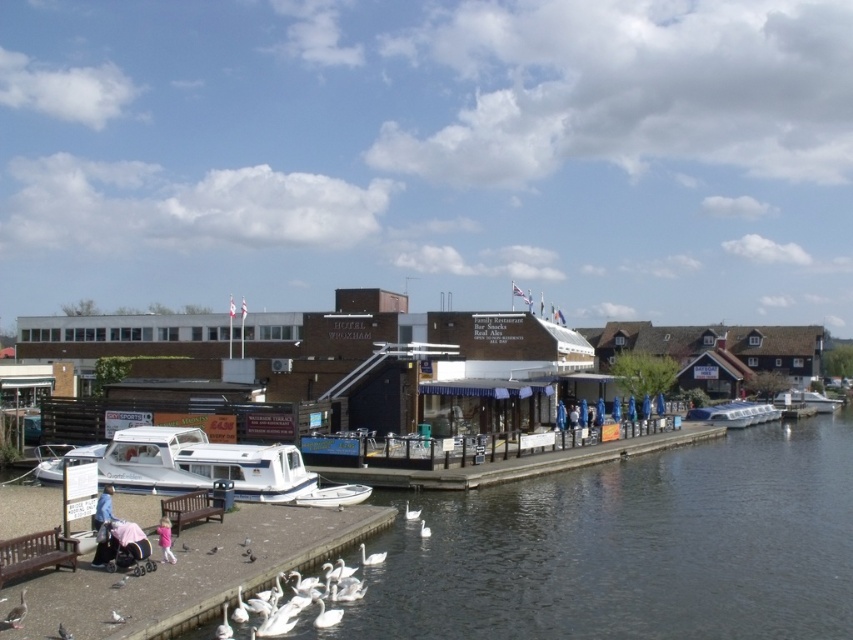
Question: Considering the real-world distances, which object is farthest from the brown wooden bench at lower left?

Choices:
 (A) clear water at dock center
 (B) white glossy boat at center

Answer: (B)

Question: Can you confirm if white glossy boat at lower left is thinner than white plastic boat at center?

Choices:
 (A) no
 (B) yes

Answer: (A)

Question: Can you confirm if white glossy boat at center is positioned above white plastic boat at center?

Choices:
 (A) no
 (B) yes

Answer: (B)

Question: Among these points, which one is farthest from the camera?

Choices:
 (A) (144, 468)
 (B) (734, 611)
 (C) (741, 413)
 (D) (809, 392)

Answer: (D)

Question: Does white glossy boat at lower left have a greater width compared to brown wooden bench at lower left?

Choices:
 (A) yes
 (B) no

Answer: (A)

Question: Which object is the closest to the brown wooden bench at lower left?

Choices:
 (A) white glossy boat at lower left
 (B) clear water at dock center
 (C) smooth wooden dock at lower left
 (D) white plastic boat at center

Answer: (C)